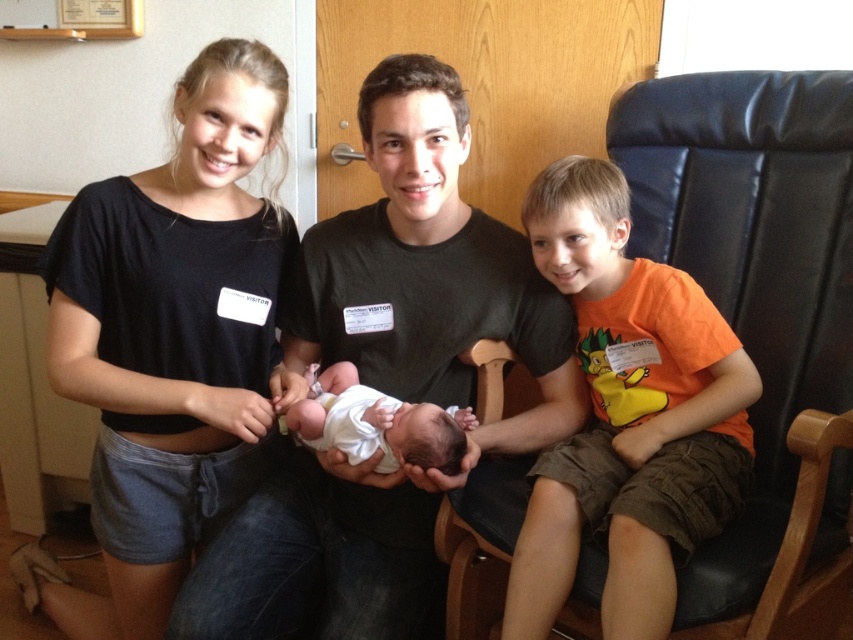
Who is positioned more to the right, black cotton shirt at upper left or white soft newborn at center?

From the viewer's perspective, white soft newborn at center appears more on the right side.

Image resolution: width=853 pixels, height=640 pixels. I want to click on black cotton shirt at upper left, so click(x=173, y=340).

Is orange cotton shirt at right further to camera compared to white soft newborn at center?

No, orange cotton shirt at right is in front of white soft newborn at center.

The image size is (853, 640). I want to click on orange cotton shirt at right, so click(628, 416).

Find the location of `matte black shirt at center`. matte black shirt at center is located at coordinates (387, 385).

Which of these two, matte black shirt at center or orange cotton shirt at right, stands shorter?

With less height is orange cotton shirt at right.

Does point (431, 230) come closer to viewer compared to point (717, 384)?

No, (431, 230) is behind (717, 384).

Locate an element on the screen. The width and height of the screenshot is (853, 640). matte black shirt at center is located at coordinates (387, 385).